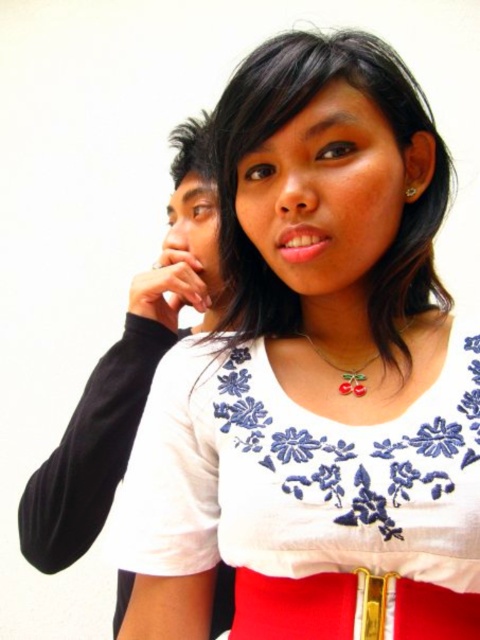
You are a photographer setting up a shoot. You need to position a light source to the right of the white embroidered dress at center and to the left of the black matte shirt at left. Is this possible based on their current positions?

The white embroidered dress at center is positioned on the right side of the black matte shirt at left, so placing a light source to the right of the white embroidered dress at center would also place it to the left of the black matte shirt at left. This is possible as their arrangement allows for such positioning.

You are standing in front of the two people in the image. There is a point marked at coordinates (309, 499). Which object from the scene is located exactly at this point?

The white embroidered dress at center is located exactly at point (309, 499).

You are a photographer adjusting the lighting for a photo shoot. You notice the white embroidered dress at center and the matte black hand at upper left in the frame. Which object is closer to the camera based on their positions?

The white embroidered dress at center is positioned under the matte black hand at upper left, meaning the hand is closer to the camera since it appears above the dress.